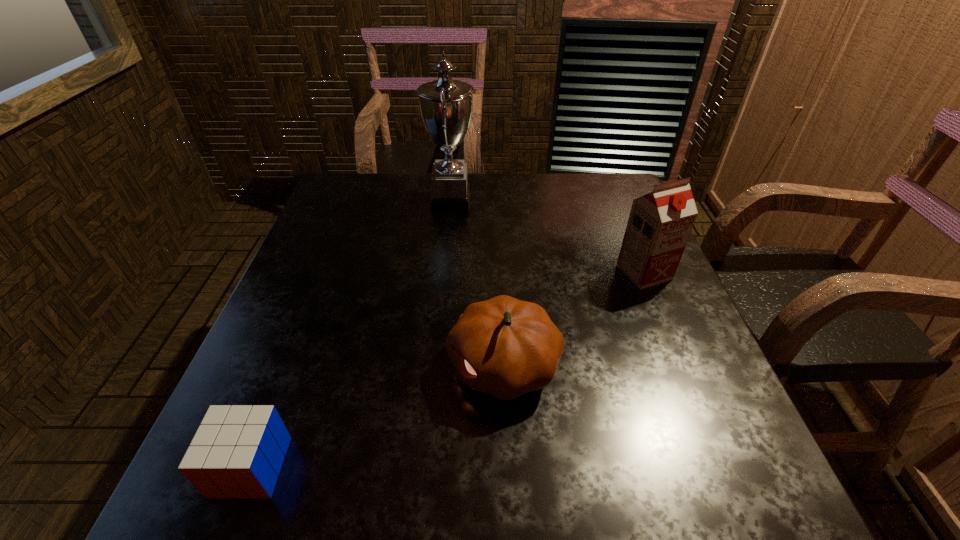
You are a GUI agent. You are given a task and a screenshot of the screen. Output one action in this format:
    pyautogui.click(x=<x>, y=<y>)
    Task: Click on the vacant space situated 0.120m on the front face of the pumpkin
    The width and height of the screenshot is (960, 540).
    Given the screenshot: What is the action you would take?
    pyautogui.click(x=385, y=365)

Where is `free space located 0.090m on the front face of the pumpkin`? This screenshot has width=960, height=540. free space located 0.090m on the front face of the pumpkin is located at coordinates (400, 365).

This screenshot has width=960, height=540. Identify the location of vacant space located 0.380m on the front face of the pumpkin. (252, 365).

You are a GUI agent. You are given a task and a screenshot of the screen. Output one action in this format:
    pyautogui.click(x=<x>, y=<y>)
    Task: Click on the blank space located on the right of the leftmost object
    This screenshot has width=960, height=540.
    Given the screenshot: What is the action you would take?
    pyautogui.click(x=431, y=467)

The image size is (960, 540). Find the location of `object at the far edge`. object at the far edge is located at coordinates (446, 105).

Find the location of `object that is at the near edge`. object that is at the near edge is located at coordinates (237, 452).

You are a GUI agent. You are given a task and a screenshot of the screen. Output one action in this format:
    pyautogui.click(x=<x>, y=<y>)
    Task: Click on the object that is at the left edge
    The width and height of the screenshot is (960, 540).
    Given the screenshot: What is the action you would take?
    pyautogui.click(x=237, y=452)

Locate an element on the screen. object that is at the right edge is located at coordinates (659, 225).

Where is `object positioned at the near left corner`? object positioned at the near left corner is located at coordinates (237, 452).

Where is `free region at the far edge`? This screenshot has width=960, height=540. free region at the far edge is located at coordinates (477, 204).